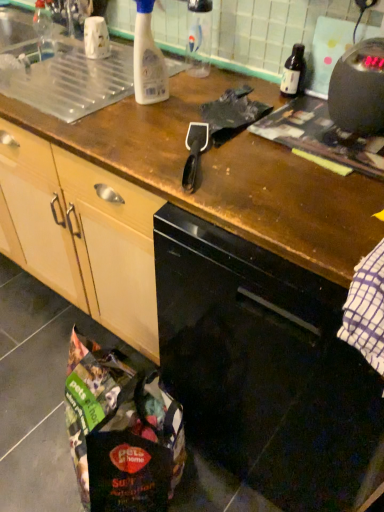
The width and height of the screenshot is (384, 512). In order to click on free space in front of transparent plastic bottle at upper center, which appears as the second bottle when viewed from the right in this screenshot , I will do `click(191, 92)`.